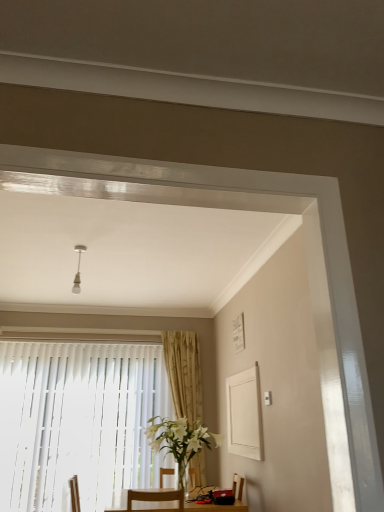
Question: In the image, is white glass vase at center on the left side or the right side of white vertical blinds at lower left?

Choices:
 (A) right
 (B) left

Answer: (A)

Question: Is point (215, 444) positioned closer to the camera than point (13, 485)?

Choices:
 (A) closer
 (B) farther

Answer: (B)

Question: Based on their relative distances, which object is nearer to the gold textured curtain at center?

Choices:
 (A) white vertical blinds at lower left
 (B) white glass vase at center

Answer: (A)

Question: Which is farther from the white glass vase at center?

Choices:
 (A) white vertical blinds at lower left
 (B) gold textured curtain at center

Answer: (A)